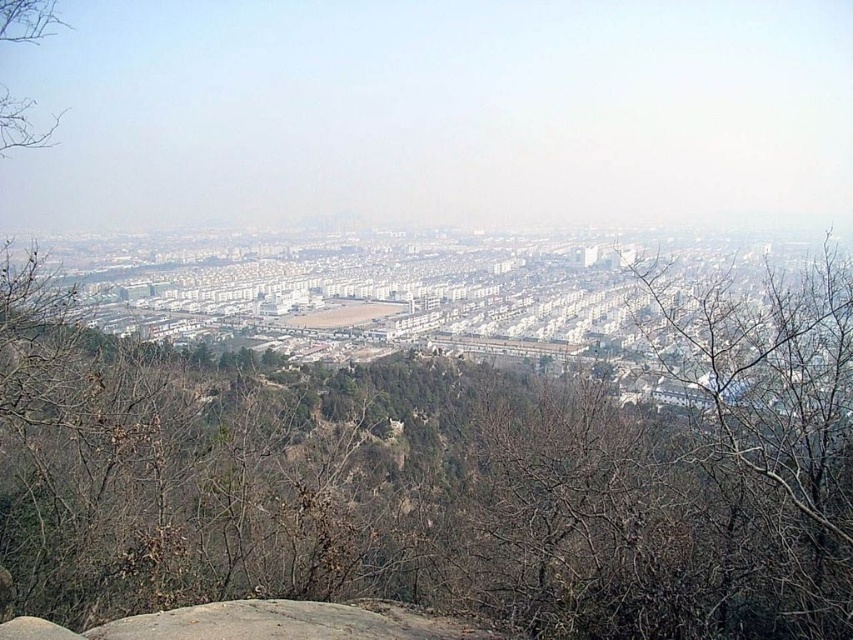
You are a hiker standing at the edge of a forest looking at the brown leafless tree at center and the gray rough rock at center. Which object is closer to you?

The brown leafless tree at center is closer to you because the gray rough rock at center is behind it.

You are standing at the top of a hill overlooking the city. You notice a brown leafless tree at center and a gray rough rock at center in the foreground. Which object is positioned to the right side of the other?

The brown leafless tree at center is to the right of the gray rough rock at center.